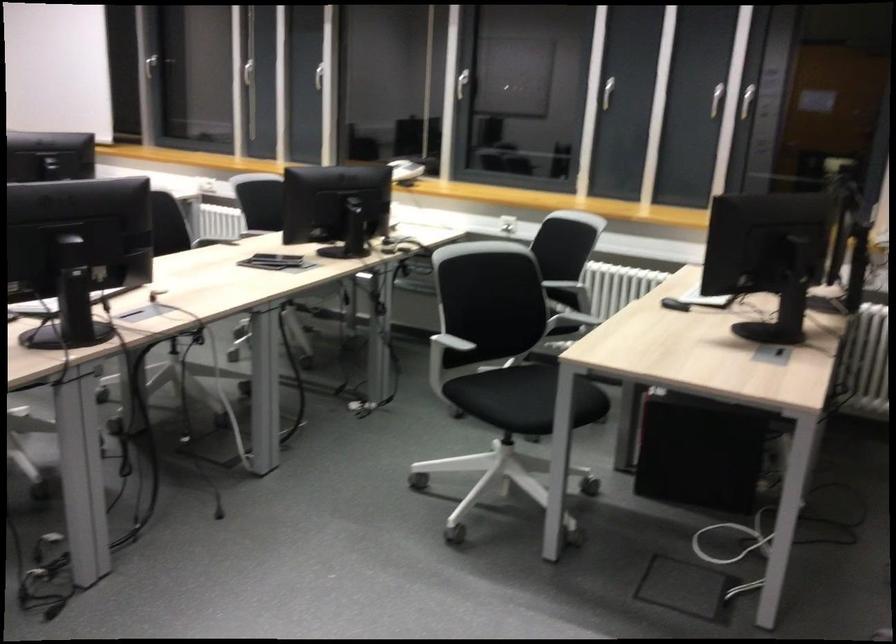
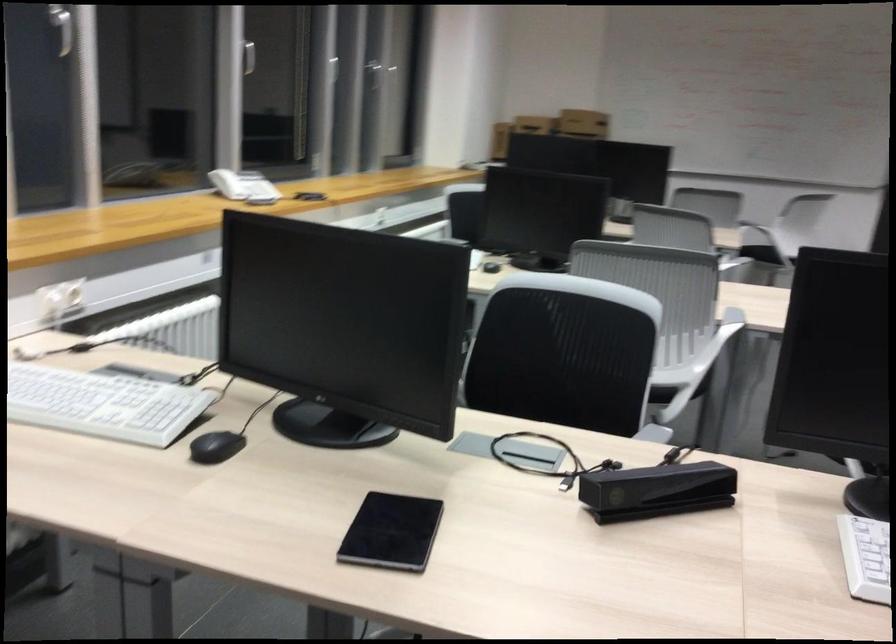
Question: I am providing you with two images of the same scene from different viewpoints. Which of the following objects are not visible in image2?

Choices:
 (A) black computer mouse
 (B) hair styling tool
 (C) black tablet
 (D) black chair sitting surface

Answer: (D)